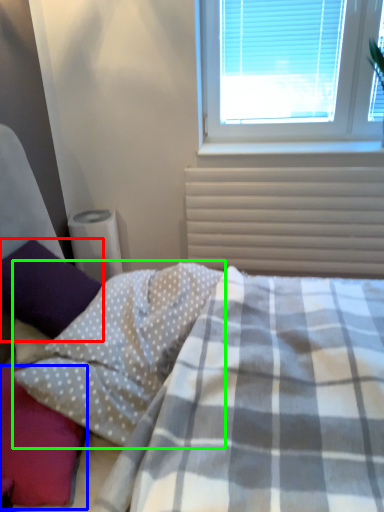
Question: Estimate the real-world distances between objects in this image. Which object is farther from pillow (highlighted by a red box), pillow (highlighted by a blue box) or pillow (highlighted by a green box)?

Choices:
 (A) pillow
 (B) pillow

Answer: (A)